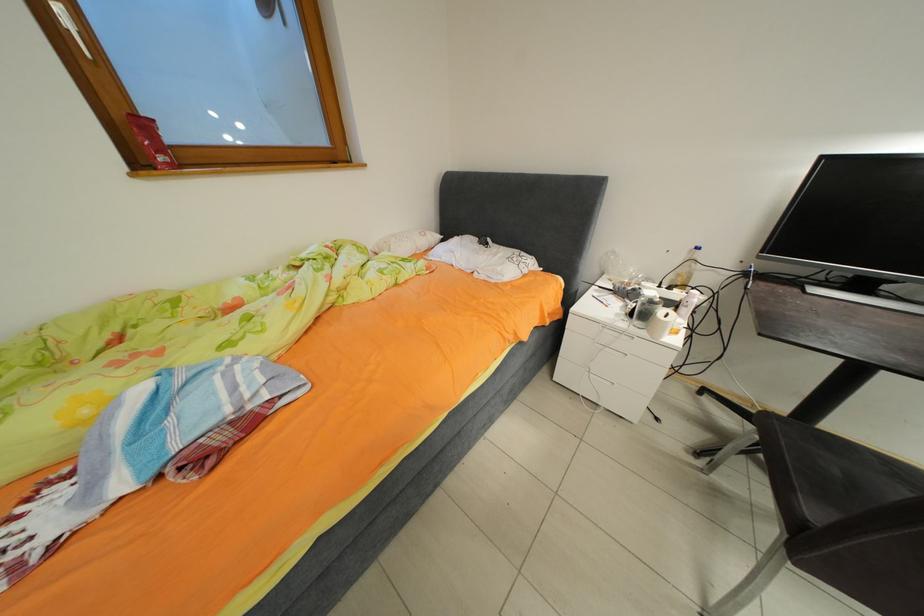
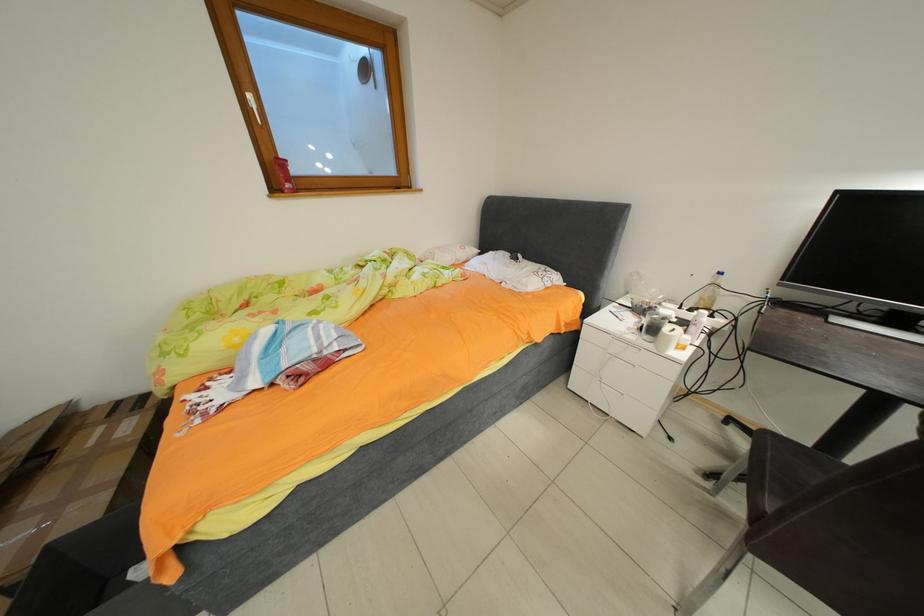
Question: Based on the continuous images, in which direction is the camera rotating? Reply with the corresponding letter.

Choices:
 (A) Left
 (B) Right
 (C) Up
 (D) Down

Answer: (A)